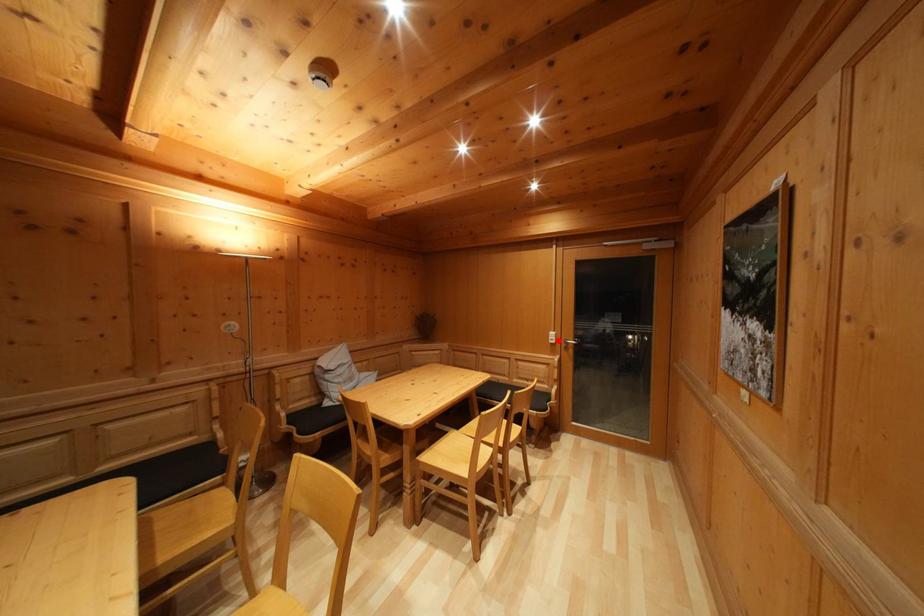
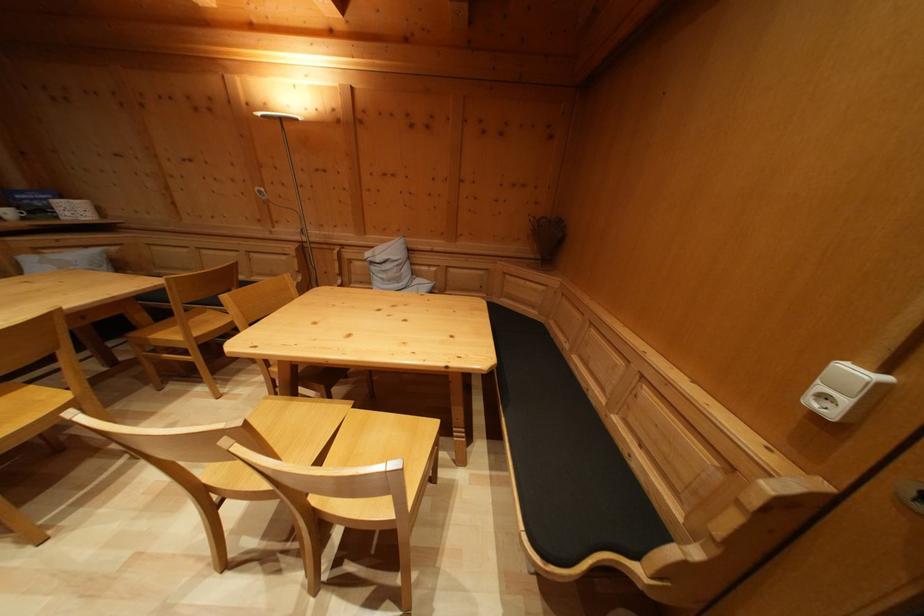
The point at the highlighted location is marked in the first image. Where is the corresponding point in the second image?

(859, 379)